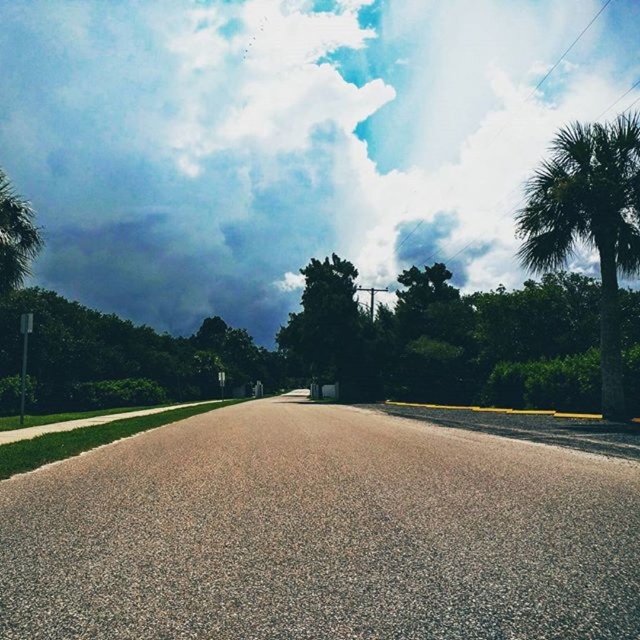
You are standing at the center of the road and looking straight ahead. Which direction should you turn to face the green leafy palm tree at right?

The green leafy palm tree at right is located at the center right of the frame, so you should turn to your right to face it.

You are standing on the sidewalk on the left side of the road and want to look up at both the cloudy sky at upper center and the green leafy tree at center. Which one will you have to tilt your head back more to see?

The cloudy sky at upper center has a greater height compared to the green leafy tree at center, so you will have to tilt your head back more to see the cloudy sky at upper center.